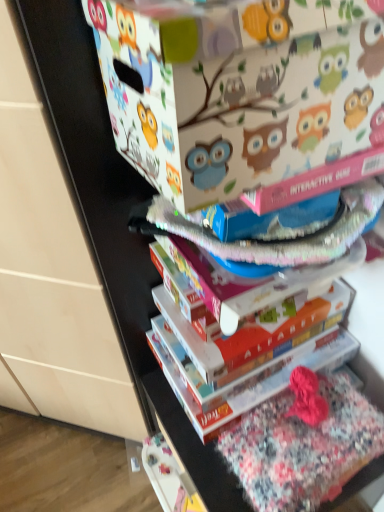
Question: From a real-world perspective, does matte white cardboard box at upper center sit lower than floral cotton fabric at lower right?

Choices:
 (A) yes
 (B) no

Answer: (B)

Question: Considering the relative sizes of matte white cardboard box at upper center and floral cotton fabric at lower right in the image provided, is matte white cardboard box at upper center taller than floral cotton fabric at lower right?

Choices:
 (A) yes
 (B) no

Answer: (A)

Question: Can you confirm if matte white cardboard box at upper center is bigger than floral cotton fabric at lower right?

Choices:
 (A) yes
 (B) no

Answer: (A)

Question: Is matte white cardboard box at upper center closer to camera compared to floral cotton fabric at lower right?

Choices:
 (A) yes
 (B) no

Answer: (A)

Question: Is matte white cardboard box at upper center behind floral cotton fabric at lower right?

Choices:
 (A) yes
 (B) no

Answer: (B)

Question: Considering the relative sizes of matte white cardboard box at upper center and floral cotton fabric at lower right in the image provided, is matte white cardboard box at upper center wider than floral cotton fabric at lower right?

Choices:
 (A) yes
 (B) no

Answer: (A)

Question: Is hardcover book at center positioned behind floral cotton fabric at lower right?

Choices:
 (A) no
 (B) yes

Answer: (B)

Question: From the image's perspective, would you say hardcover book at center is shown under floral cotton fabric at lower right?

Choices:
 (A) no
 (B) yes

Answer: (A)

Question: From the image's perspective, is hardcover book at center over floral cotton fabric at lower right?

Choices:
 (A) yes
 (B) no

Answer: (A)

Question: Does hardcover book at center have a lesser height compared to floral cotton fabric at lower right?

Choices:
 (A) no
 (B) yes

Answer: (B)

Question: Considering the relative positions of hardcover book at center and floral cotton fabric at lower right in the image provided, is hardcover book at center in front of floral cotton fabric at lower right?

Choices:
 (A) yes
 (B) no

Answer: (B)

Question: Is hardcover book at center located outside floral cotton fabric at lower right?

Choices:
 (A) no
 (B) yes

Answer: (B)

Question: Is hardcover book at center at the back of matte white cardboard box at upper center?

Choices:
 (A) no
 (B) yes

Answer: (A)